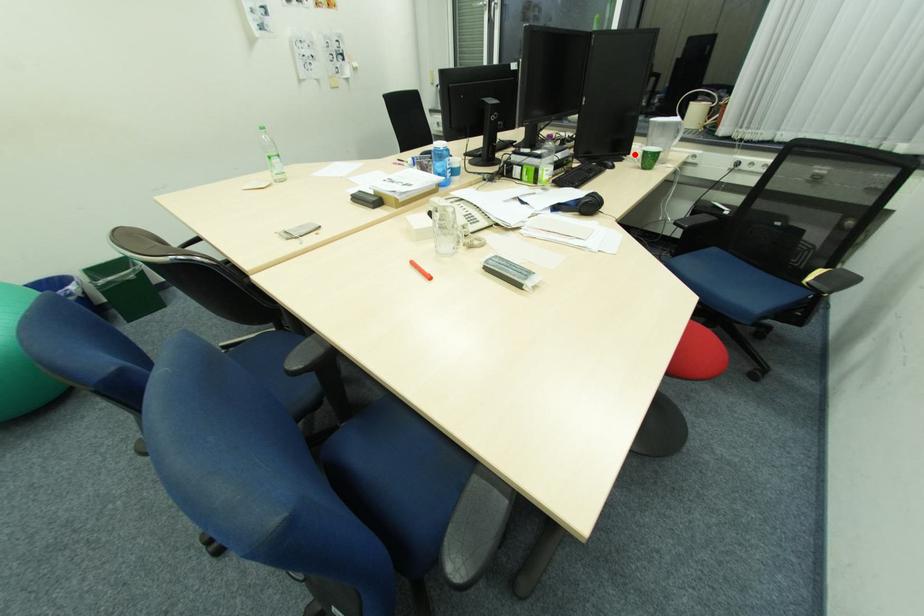
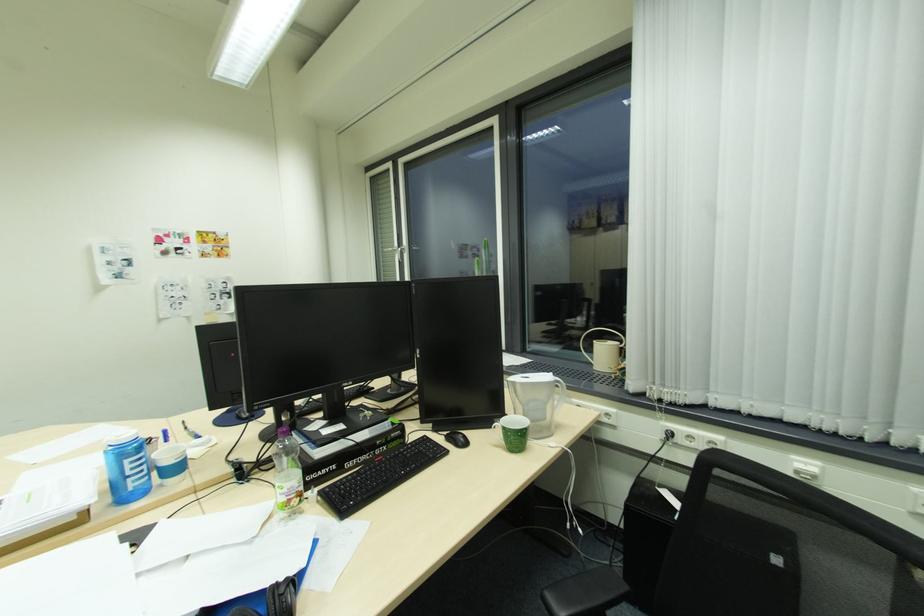
Question: I am providing you with two images of the same scene from different viewpoints. A red point is marked on the first image. Is the red point's position out of view in image 2?

Choices:
 (A) Yes
 (B) No

Answer: (A)